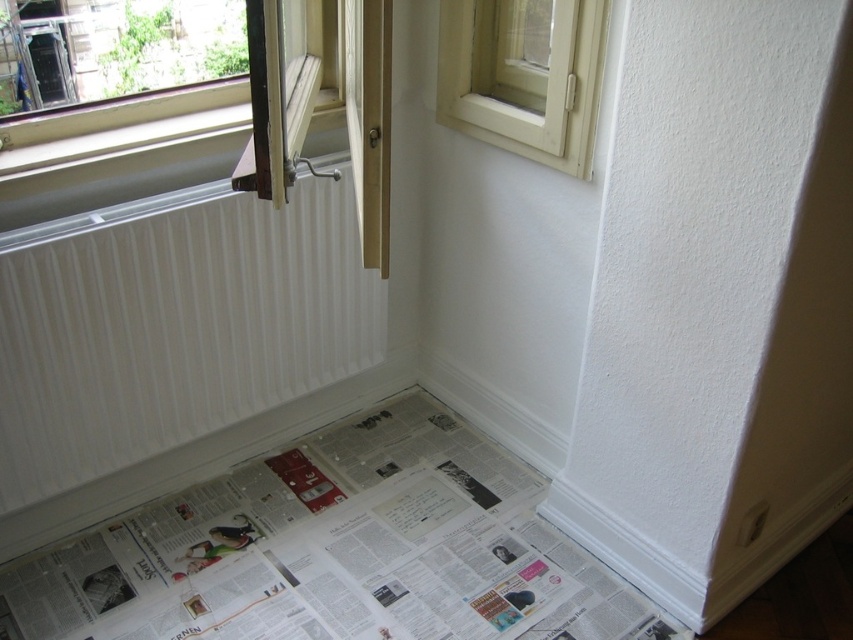
You are standing in the room and want to place a small potted plant on the floor near the white ribbed radiator at lower left without blocking the view of the white plastic window at upper right. Is this possible?

The white ribbed radiator at lower left is in front of the white plastic window at upper right, so placing the plant near the radiator might block the view of the window. Choose a spot where the plant is behind the radiator or to the side to avoid blocking the window.

Looking at this image, you are standing in the room and want to determine which of the two points, point (405, 541) or point (253, 250), is closer to you. Based on the scene, can you identify which point is nearer?

Point (253, 250) is closer to you because it is less further to the camera than point (405, 541).